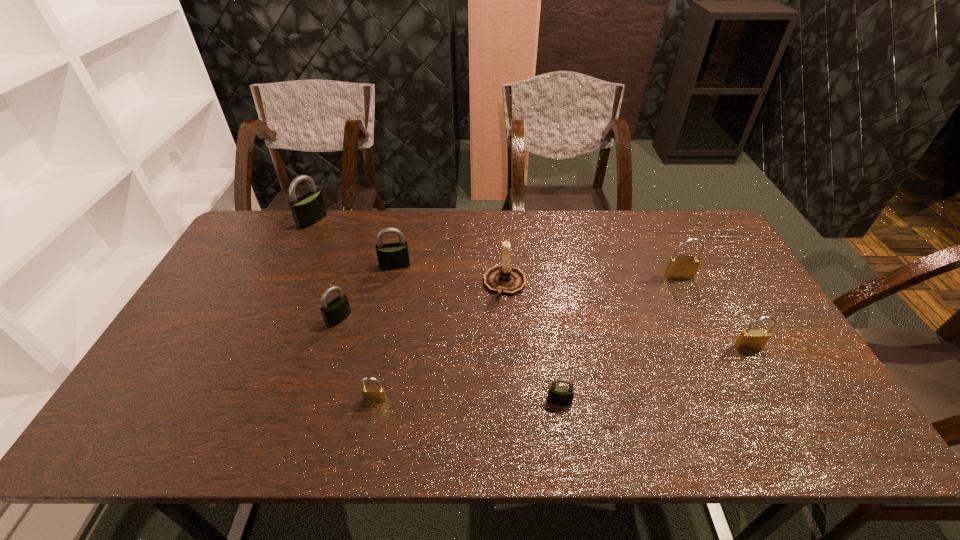
The image size is (960, 540). I want to click on vacant space at the far right corner of the desktop, so click(696, 212).

The image size is (960, 540). Identify the location of vacant point located between the farthest brass padlock and the nearest black padlock. (619, 339).

Find the location of a particular element. empty space that is in between the rightmost padlock and the candle holder is located at coordinates (627, 315).

Locate an element on the screen. blank region between the leftmost padlock and the second padlock from left to right is located at coordinates (325, 270).

Find the location of a particular element. The width and height of the screenshot is (960, 540). free spot between the second nearest brass padlock and the fifth object from left to right is located at coordinates (627, 315).

You are a GUI agent. You are given a task and a screenshot of the screen. Output one action in this format:
    pyautogui.click(x=<x>, y=<y>)
    Task: Click on the free space between the farthest object and the second farthest black padlock
    
    Given the screenshot: What is the action you would take?
    pyautogui.click(x=353, y=243)

Locate an element on the screen. free spot between the fifth nearest padlock and the leftmost padlock is located at coordinates (495, 248).

I want to click on free area in between the fourth nearest object and the biggest black padlock, so click(x=325, y=270).

The width and height of the screenshot is (960, 540). Identify the location of vacant area that lies between the third biggest black padlock and the leftmost padlock. (325, 270).

Where is `vacant space in between the leftmost brass padlock and the smallest black padlock`? vacant space in between the leftmost brass padlock and the smallest black padlock is located at coordinates (468, 400).